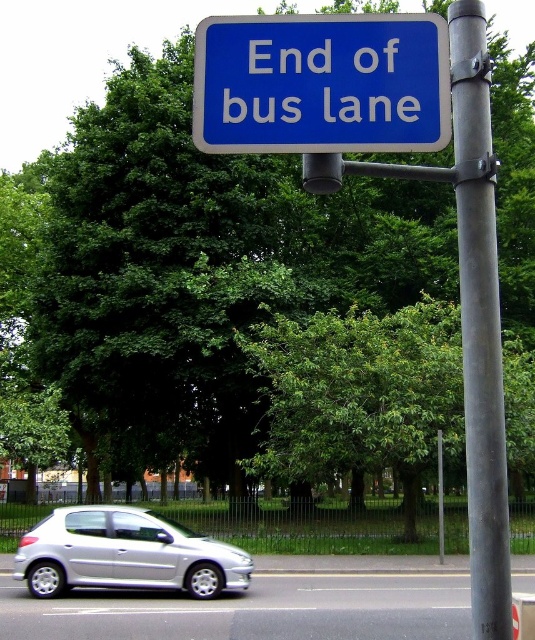
Consider the image. You are a driver approaching the metallic gray pole at center right. Based on its position at point 0.505, 0.897, can you estimate how far it is from the center of the image?

The metallic gray pole at center right is located at point (479, 323), which is very close to the center of the image. Since the coordinate system typically ranges from 0 to 1 in both axes, 0.5 would be the exact center. The pole is slightly to the right and lower than the exact center, but still very near.

You are a driver approaching the blue plastic sign at upper center and the silver metallic car at lower left. Which object is wider?

The blue plastic sign at upper center is wider than the silver metallic car at lower left.

Looking at this image, you are a pedestrian standing on the sidewalk and see the blue plastic sign at upper center and the silver metallic car at lower left. Which object is nearer to you?

The blue plastic sign at upper center is closer to the viewer than the silver metallic car at lower left.